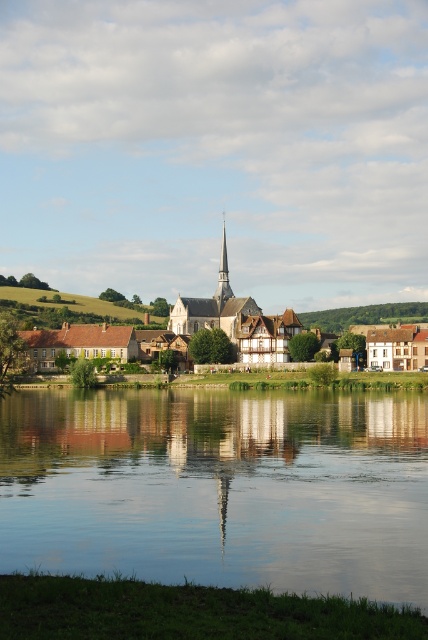
You are a tourist standing at the riverside and want to take a photo of the white wooden church at center and the smooth white spire at center. Based on their positions, which one should you focus on first to ensure both are in the frame?

The white wooden church at center is below the smooth white spire at center, so you should focus on the smooth white spire at center first to ensure both are in the frame.

You are an architect analyzing the church and its spire. Based on the scene, which object is taller between the white wooden church at center and the smooth white spire at center?

The white wooden church at center is taller than the smooth white spire at center.